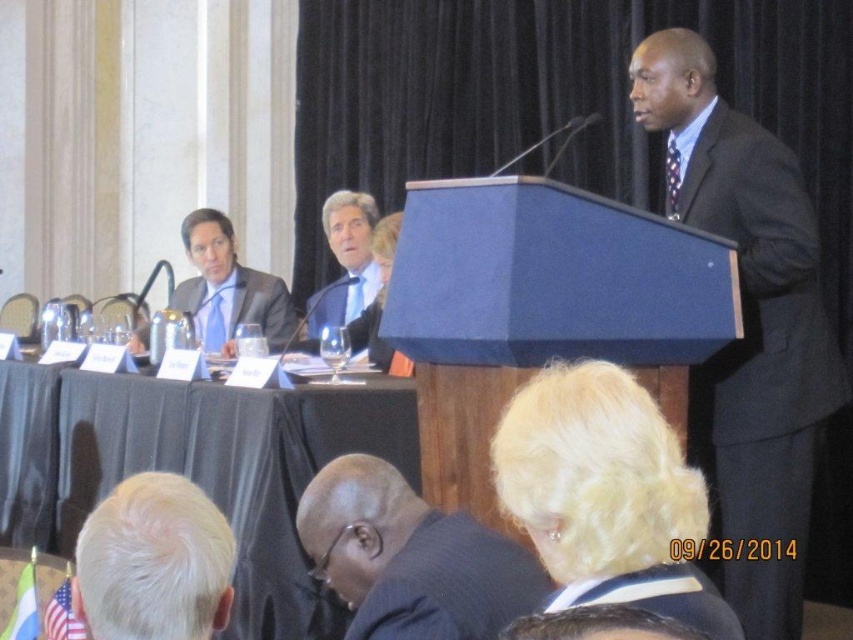
Question: Can you confirm if black fabric table at lower center is wider than black textured suit at lower center?

Choices:
 (A) yes
 (B) no

Answer: (A)

Question: Which of the following is the farthest from the observer?

Choices:
 (A) black fabric table at lower center
 (B) black textured suit at lower center

Answer: (A)

Question: Does black textured suit at lower center appear on the right side of white hair at lower left?

Choices:
 (A) no
 (B) yes

Answer: (B)

Question: Can you confirm if dark gray suit at center is smaller than matte black suit at left?

Choices:
 (A) yes
 (B) no

Answer: (B)

Question: Among these objects, which one is farthest from the camera?

Choices:
 (A) black matte business suit at upper center
 (B) black fabric table at lower center
 (C) matte blue suit at center
 (D) matte black suit at left

Answer: (D)

Question: Estimate the real-world distances between objects in this image. Which object is closer to the white hair at lower left?

Choices:
 (A) matte blue suit at center
 (B) black textured suit at lower center
 (C) matte black suit at left

Answer: (B)